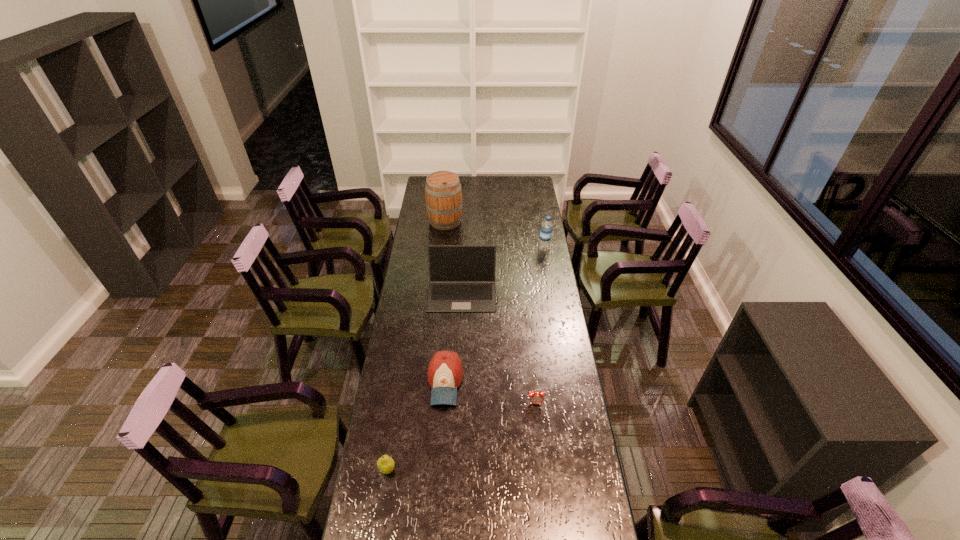
At what (x,y) coordinates should I click in order to perform the action: click on free area in between the nearest object and the laptop. Please return your answer as a coordinate pair (x, y). The width and height of the screenshot is (960, 540). Looking at the image, I should click on (424, 381).

Choose which object is the fourth nearest neighbor to the pear. Please provide its 2D coordinates. Your answer should be formatted as a tuple, i.e. [(x, y)], where the tuple contains the x and y coordinates of a point satisfying the conditions above.

[(546, 229)]

Point out which object is positioned as the fifth nearest to the fifth object from left to right. Please provide its 2D coordinates. Your answer should be formatted as a tuple, i.e. [(x, y)], where the tuple contains the x and y coordinates of a point satisfying the conditions above.

[(443, 193)]

Where is `vacant space that satisfies the following two spatial constraints: 1. on the label of the second farthest object; 2. on the face of the second object from right to left`? The width and height of the screenshot is (960, 540). vacant space that satisfies the following two spatial constraints: 1. on the label of the second farthest object; 2. on the face of the second object from right to left is located at coordinates (571, 403).

This screenshot has width=960, height=540. In order to click on vacant position in the image that satisfies the following two spatial constraints: 1. on the label of the fifth nearest object; 2. on the face of the alarm clock in this screenshot , I will do pos(571,403).